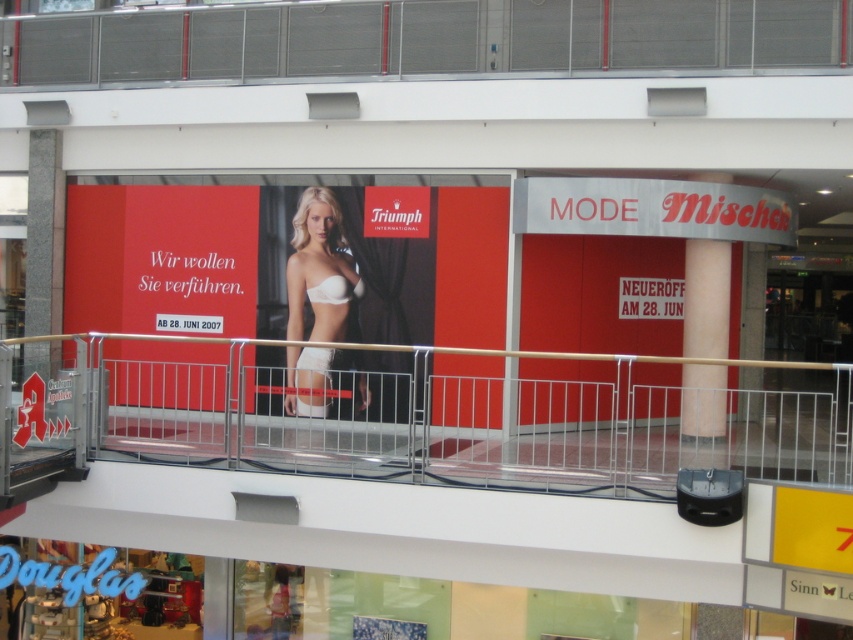
You are a customer in the mall and want to walk between the metallic silver railing at center and the beige smooth column at center. Can you pass through the space between them comfortably?

The metallic silver railing at center is narrower than the beige smooth column at center, so the space between them may be tight. However, since the railing is thinner, you should be able to pass through comfortably if you move carefully.

You are a customer standing in the shopping mall and see the metallic silver railing at center and the matte red poster at upper center. Which object is positioned to the right of the other?

The metallic silver railing at center is to the right of the matte red poster at upper center.